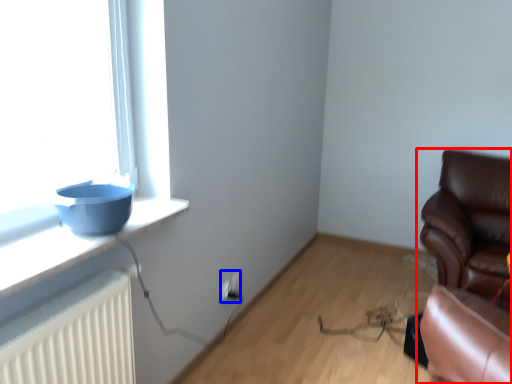
Question: Which point is further to the camera, chair (highlighted by a red box) or electric outlet (highlighted by a blue box)?

Choices:
 (A) chair
 (B) electric outlet

Answer: (B)